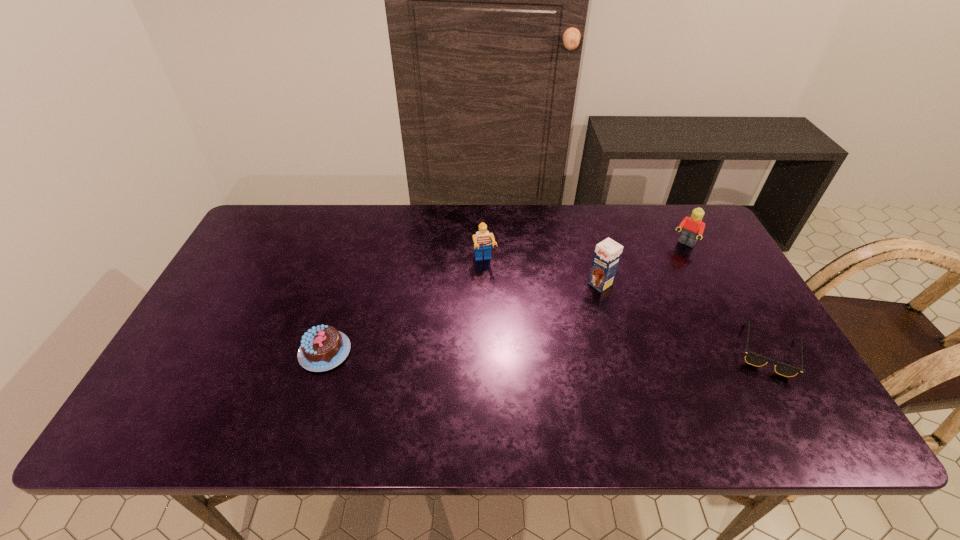
At what (x,y) coordinates should I click in order to perform the action: click on the leftmost object. Please return your answer as a coordinate pair (x, y). Looking at the image, I should click on (322, 348).

I want to click on the second shortest object, so click(322, 348).

Locate an element on the screen. The image size is (960, 540). the shortest object is located at coordinates (752, 358).

Find the location of a particular element. the fourth nearest object is located at coordinates (482, 241).

In order to click on the fourth object from right to left in this screenshot , I will do `click(482, 241)`.

This screenshot has width=960, height=540. In order to click on the third farthest object in this screenshot , I will do `click(607, 254)`.

Identify the location of the third object from right to left. The width and height of the screenshot is (960, 540). (607, 254).

Where is `the right Lego`? This screenshot has width=960, height=540. the right Lego is located at coordinates (693, 226).

The image size is (960, 540). Identify the location of the farthest object. (693, 226).

What are the coordinates of `free space located 0.140m on the back of the second shortest object` in the screenshot? It's located at [x=344, y=292].